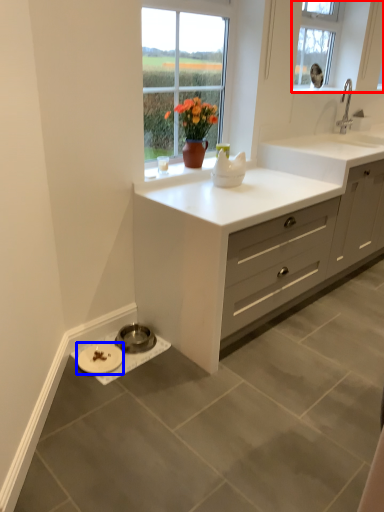
Question: Which point is closer to the camera, window (highlighted by a red box) or platter (highlighted by a blue box)?

Choices:
 (A) window
 (B) platter

Answer: (B)